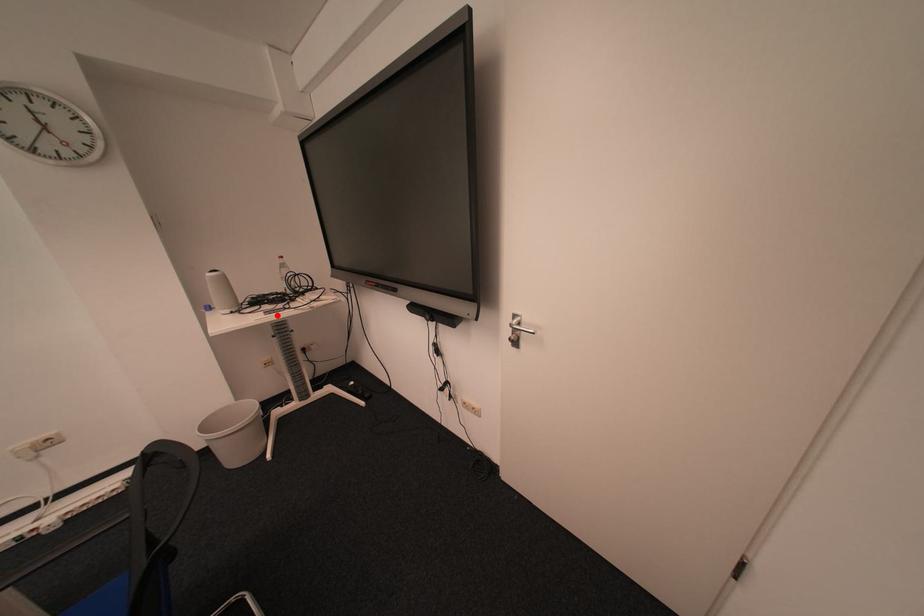
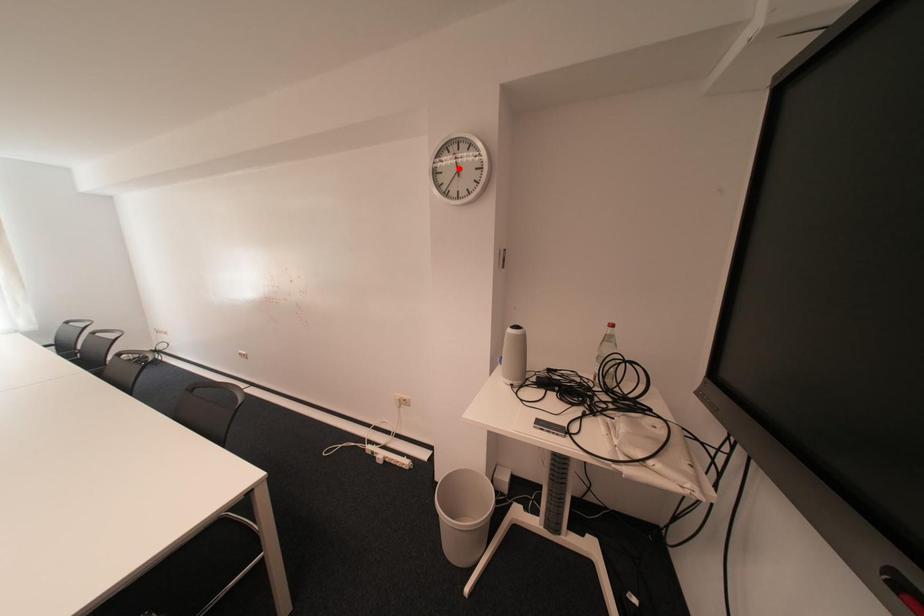
I am providing you with two images of the same scene from different viewpoints. A red point is marked on the first image and another point is marked on the second image. Are the points marked in image1 and image2 representing the same 3D position?

No